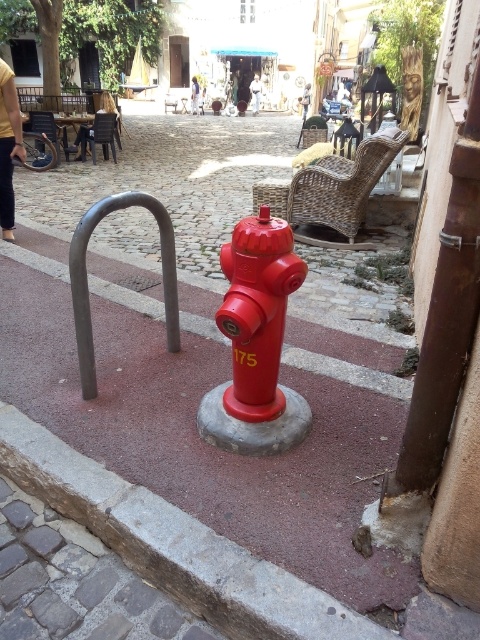
You are standing at the center of the image and want to locate the rusty metal pole at right. According to the coordinates provided, in which direction should you look to find it?

The rusty metal pole at right is located at coordinates point (444, 321), so you should look to the right side of the image to find it.

You are a delivery person standing in the street and need to place a 1.2 meter long box between the bright red fire hydrant and the rusty metal pole at right. Can you fit the box between them?

The distance between the bright red fire hydrant and the rusty metal pole at right is 1.16 meters. Since the box is 1.2 meters long, it cannot fit between them as the space is slightly shorter than the box.

You are standing at the fire hydrant in the foreground of the street scene. Looking towards the center of the image, you see a point marked at coordinates (173, 545). What object is located at that point?

The point at coordinates (173, 545) marks the gray concrete curb at center.